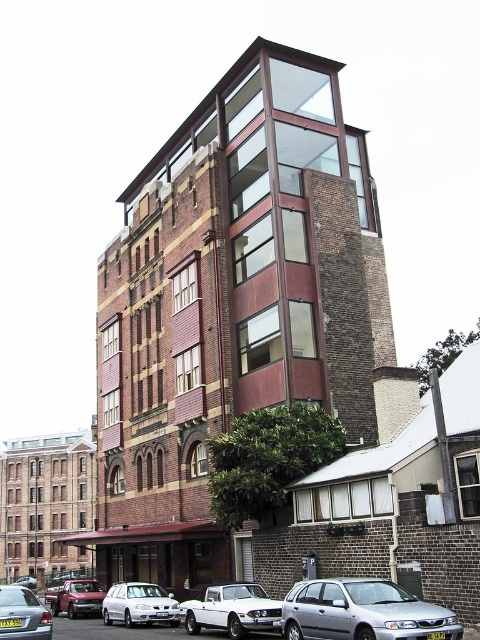
Question: Which point is farther to the camera?

Choices:
 (A) (36, 612)
 (B) (379, 593)
 (C) (264, 600)

Answer: (C)

Question: In this image, where is silver metallic sedan at lower center located relative to white glossy pickup truck at lower center?

Choices:
 (A) left
 (B) right

Answer: (B)

Question: Can you confirm if silver metallic sedan at lower center is thinner than metallic silver sedan at lower left?

Choices:
 (A) yes
 (B) no

Answer: (A)

Question: Estimate the real-world distances between objects in this image. Which object is farther from the white matte hatchback at lower left?

Choices:
 (A) silver metallic sedan at lower left
 (B) white glossy pickup truck at lower center
 (C) metallic silver sedan at lower left
 (D) silver metallic sedan at lower center

Answer: (C)

Question: In this image, where is silver metallic sedan at lower center located relative to silver metallic sedan at lower left?

Choices:
 (A) right
 (B) left

Answer: (A)

Question: Which object is positioned closest to the silver metallic sedan at lower left?

Choices:
 (A) metallic silver sedan at lower left
 (B) silver metallic sedan at lower center

Answer: (B)